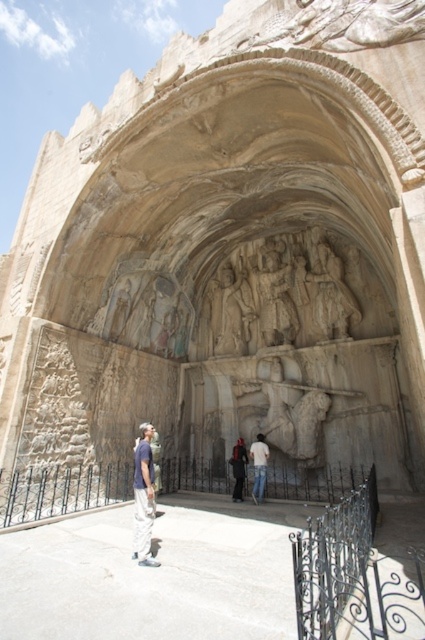
Is point (136, 552) less distant than point (266, 468)?

Yes, it is.

Is light blue denim jeans at lower left below white cotton shirt at center?

Actually, light blue denim jeans at lower left is above white cotton shirt at center.

Who is more distant from viewer, (x=138, y=477) or (x=261, y=467)?

Positioned behind is point (x=261, y=467).

The height and width of the screenshot is (640, 425). Find the location of `light blue denim jeans at lower left`. light blue denim jeans at lower left is located at coordinates (144, 497).

Between carved stone figures at center and dark blue jeans at center, which one appears on the right side from the viewer's perspective?

From the viewer's perspective, dark blue jeans at center appears more on the right side.

Is carved stone figures at center thinner than dark blue jeans at center?

Incorrect, carved stone figures at center's width is not less than dark blue jeans at center's.

Image resolution: width=425 pixels, height=640 pixels. Describe the element at coordinates (229, 310) in the screenshot. I see `carved stone figures at center` at that location.

Find the location of `carved stone figures at center`. carved stone figures at center is located at coordinates (229, 310).

Can you confirm if carved stone figures at center is shorter than white cotton shirt at center?

Incorrect, carved stone figures at center's height does not fall short of white cotton shirt at center's.

Looking at this image, is carved stone figures at center taller than white cotton shirt at center?

Correct, carved stone figures at center is much taller as white cotton shirt at center.

In the scene shown: Measure the distance between carved stone figures at center and camera.

carved stone figures at center and camera are 77.38 meters apart from each other.

Locate an element on the screen. The height and width of the screenshot is (640, 425). carved stone figures at center is located at coordinates (229, 310).